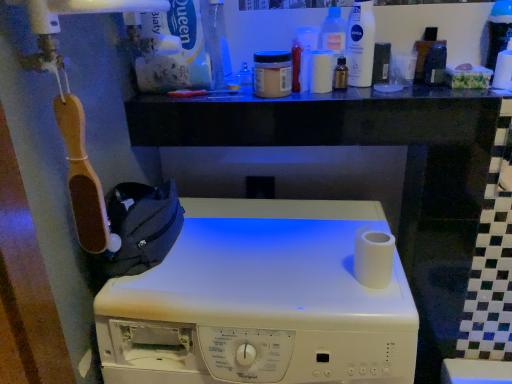
What do you see at coordinates (216, 40) in the screenshot? The image size is (512, 384). I see `transparent glass bottle at upper center` at bounding box center [216, 40].

Describe the element at coordinates (373, 257) in the screenshot. I see `white matte toilet paper at right, the second toilet paper positioned from the back` at that location.

Identify the location of matte plastic container at center, which is counted as the sixth toiletry, starting from the right. (245, 75).

The width and height of the screenshot is (512, 384). What are the coordinates of `white matte bottle at upper center, the 3th toiletry in the right-to-left sequence` in the screenshot? It's located at (321, 71).

This screenshot has width=512, height=384. What do you see at coordinates (333, 32) in the screenshot? I see `translucent plastic bottle at upper center, which is counted as the 1th cleaning product, starting from the left` at bounding box center [333, 32].

Where is `translucent amber bottle at upper center, the second toiletry in the right-to-left sequence`? This screenshot has height=384, width=512. translucent amber bottle at upper center, the second toiletry in the right-to-left sequence is located at coordinates (340, 74).

At what (x,y) coordinates should I click in order to perform the action: click on transparent glass bottle at upper center. Please return your answer as a coordinate pair (x, y). Image resolution: width=512 pixels, height=384 pixels. Looking at the image, I should click on (216, 40).

From the image's perspective, is white matte bottle at upper center, the 3th toiletry in the right-to-left sequence, below white matte toilet paper at right, the second toilet paper positioned from the back?

No, from the image's perspective, white matte bottle at upper center, the 3th toiletry in the right-to-left sequence, is not below white matte toilet paper at right, the second toilet paper positioned from the back.

Could you measure the distance between white matte bottle at upper center, the 4th toiletry viewed from the left, and white matte toilet paper at right, arranged as the first toilet paper when viewed from the left?

white matte bottle at upper center, the 4th toiletry viewed from the left, and white matte toilet paper at right, arranged as the first toilet paper when viewed from the left, are 16.28 inches apart from each other.

Could you tell me if white matte bottle at upper center, the 3th toiletry in the right-to-left sequence, is turned towards white matte toilet paper at right, arranged as the 2th toilet paper when viewed from the right?

No, white matte bottle at upper center, the 3th toiletry in the right-to-left sequence, is not aimed at white matte toilet paper at right, arranged as the 2th toilet paper when viewed from the right.

From a real-world perspective, between matte plastic container at center, which is counted as the sixth toiletry, starting from the right, and matte brown jar at upper center, the 5th toiletry from the right, who is vertically higher?

matte brown jar at upper center, the 5th toiletry from the right, from a real-world perspective.

From the image's perspective, would you say matte plastic container at center, which is counted as the sixth toiletry, starting from the right, is positioned over matte brown jar at upper center, which ranks as the second toiletry in left-to-right order?

Correct, matte plastic container at center, which is counted as the sixth toiletry, starting from the right, appears higher than matte brown jar at upper center, which ranks as the second toiletry in left-to-right order, in the image.

Can you confirm if matte plastic container at center, the first toiletry from the left, is smaller than matte brown jar at upper center, the 5th toiletry from the right?

Correct, matte plastic container at center, the first toiletry from the left, occupies less space than matte brown jar at upper center, the 5th toiletry from the right.

In terms of width, does matte plastic container at center, the first toiletry from the left, look wider or thinner when compared to matte brown jar at upper center, which ranks as the second toiletry in left-to-right order?

Clearly, matte plastic container at center, the first toiletry from the left, has less width compared to matte brown jar at upper center, which ranks as the second toiletry in left-to-right order.

Who is taller, matte black container at upper right, the first toiletry when ordered from right to left, or white matte toilet paper at right, the second toilet paper positioned from the back?

matte black container at upper right, the first toiletry when ordered from right to left, is taller.

Which is behind, point (425, 68) or point (388, 245)?

The point (425, 68) is behind.

Which toiletry is the 3rd one when counting from the back of the white matte toilet paper at right, arranged as the first toilet paper when viewed from the left? Please provide its 2D coordinates.

[(435, 64)]

Considering the sizes of transparent glass bottle at upper center and white matte toilet paper at right, positioned as the second toilet paper in top-to-bottom order, in the image, is transparent glass bottle at upper center wider or thinner than white matte toilet paper at right, positioned as the second toilet paper in top-to-bottom order,?

In the image, transparent glass bottle at upper center appears to be wider than white matte toilet paper at right, positioned as the second toilet paper in top-to-bottom order.

Based on the photo, looking at the image, does transparent glass bottle at upper center seem bigger or smaller compared to white matte toilet paper at right, acting as the 1th toilet paper starting from the bottom?

In the image, transparent glass bottle at upper center appears to be larger than white matte toilet paper at right, acting as the 1th toilet paper starting from the bottom.

From the image's perspective, is transparent glass bottle at upper center on top of white matte toilet paper at right, arranged as the first toilet paper when viewed from the left?

Correct, transparent glass bottle at upper center appears higher than white matte toilet paper at right, arranged as the first toilet paper when viewed from the left, in the image.

At what (x,y) coordinates should I click in order to perform the action: click on bottle that appears above the white matte toilet paper at right, the second toilet paper positioned from the back (from the image's perspective). Please return your answer as a coordinate pair (x, y). The height and width of the screenshot is (384, 512). Looking at the image, I should click on (216, 40).

Which object is further away from the camera taking this photo, matte black container at upper right, which is counted as the sixth toiletry, starting from the left, or matte brown jar at upper center, which ranks as the second toiletry in left-to-right order?

Positioned behind is matte black container at upper right, which is counted as the sixth toiletry, starting from the left.

Is point (426, 77) behind point (255, 74)?

No, it is in front of (255, 74).

From a real-world perspective, is matte black container at upper right, which is counted as the sixth toiletry, starting from the left, positioned above or below matte brown jar at upper center, which ranks as the second toiletry in left-to-right order?

From a real-world perspective, matte black container at upper right, which is counted as the sixth toiletry, starting from the left, is physically above matte brown jar at upper center, which ranks as the second toiletry in left-to-right order.

From a real-world perspective, which is physically below, translucent plastic bottle at upper center, which is counted as the 1th cleaning product, starting from the left, or white plastic container at center, the 4th toiletry viewed from the right?

From a 3D spatial view, white plastic container at center, the 4th toiletry viewed from the right, is below.

Which of these two, translucent plastic bottle at upper center, which is the 2th cleaning product from right to left, or white plastic container at center, the 4th toiletry viewed from the right, is wider?

translucent plastic bottle at upper center, which is the 2th cleaning product from right to left.

Is translucent plastic bottle at upper center, which is the 2th cleaning product from right to left, outside of white plastic container at center, the 4th toiletry viewed from the right?

Yes.

Could you measure the distance between matte black container at upper right, the first toiletry when ordered from right to left, and white plastic bottle at upper center, which ranks as the 1th cleaning product in right-to-left order?

They are 16.51 centimeters apart.

Is matte black container at upper right, the first toiletry when ordered from right to left, not within white plastic bottle at upper center, which ranks as the 1th cleaning product in right-to-left order?

matte black container at upper right, the first toiletry when ordered from right to left, lies outside white plastic bottle at upper center, which ranks as the 1th cleaning product in right-to-left order,'s area.

Does matte black container at upper right, which is counted as the sixth toiletry, starting from the left, turn towards white plastic bottle at upper center, which ranks as the 1th cleaning product in right-to-left order?

No, matte black container at upper right, which is counted as the sixth toiletry, starting from the left, is not oriented towards white plastic bottle at upper center, which ranks as the 1th cleaning product in right-to-left order.

From a real-world perspective, is matte black container at upper right, the first toiletry when ordered from right to left, physically located above or below white plastic bottle at upper center, which ranks as the 1th cleaning product in right-to-left order?

Clearly, from a real-world perspective, matte black container at upper right, the first toiletry when ordered from right to left, is below white plastic bottle at upper center, which ranks as the 1th cleaning product in right-to-left order.

Starting from the white matte toilet paper at right, the second toilet paper positioned from the back, which toiletry is the 2nd one to the left? Please provide its 2D coordinates.

[(321, 71)]

Where is `toiletry that is the 1st object to the right of the matte plastic container at center, the first toiletry from the left, starting at the anchor`? Image resolution: width=512 pixels, height=384 pixels. toiletry that is the 1st object to the right of the matte plastic container at center, the first toiletry from the left, starting at the anchor is located at coordinates (272, 74).

Considering their positions, is translucent amber bottle at upper center, the second toiletry in the right-to-left sequence, positioned further to matte black container at upper right, the first toiletry when ordered from right to left, than white plastic bottle at upper center, which ranks as the 1th cleaning product in right-to-left order?

translucent amber bottle at upper center, the second toiletry in the right-to-left sequence, is further to matte black container at upper right, the first toiletry when ordered from right to left.

Considering their positions, is translucent amber bottle at upper center, the 5th toiletry from the left, positioned further to translucent plastic bottle at upper center, which is the 2th cleaning product from right to left, than matte brown jar at upper center, which ranks as the second toiletry in left-to-right order?

matte brown jar at upper center, which ranks as the second toiletry in left-to-right order, is further to translucent plastic bottle at upper center, which is the 2th cleaning product from right to left.

Based on their spatial positions, is white plastic container at center, the 4th toiletry viewed from the right, or white matte bottle at upper center, the 3th toiletry in the right-to-left sequence, further from matte brown jar at upper center, which ranks as the second toiletry in left-to-right order?

Based on the image, white matte bottle at upper center, the 3th toiletry in the right-to-left sequence, appears to be further to matte brown jar at upper center, which ranks as the second toiletry in left-to-right order.

Looking at the image, which one is located closer to white plastic washing machine at center, white plastic container at center, the 3th toiletry in the left-to-right sequence, or matte black container at upper right, which is counted as the sixth toiletry, starting from the left?

white plastic container at center, the 3th toiletry in the left-to-right sequence, lies closer to white plastic washing machine at center than the other object.

Estimate the real-world distances between objects in this image. Which object is further from transparent glass bottle at upper center, white plastic bottle at upper center, the 2th cleaning product positioned from the left, or white plastic washing machine at center?

The object further to transparent glass bottle at upper center is white plastic washing machine at center.

Looking at the image, which one is located closer to white plastic washing machine at center, white plastic container at center, the 3th toiletry in the left-to-right sequence, or translucent plastic bottle at upper center, which is counted as the 1th cleaning product, starting from the left?

white plastic container at center, the 3th toiletry in the left-to-right sequence.

Estimate the real-world distances between objects in this image. Which object is closer to white matte toilet paper at upper right, the 1th toilet paper viewed from the right, white plastic container at center, the 3th toiletry in the left-to-right sequence, or white plastic bottle at upper center, which ranks as the 1th cleaning product in right-to-left order?

Among the two, white plastic bottle at upper center, which ranks as the 1th cleaning product in right-to-left order, is located nearer to white matte toilet paper at upper right, the 1th toilet paper viewed from the right.

Which object lies nearer to the anchor point white matte toilet paper at right, arranged as the first toilet paper when viewed from the left, matte plastic container at center, which is counted as the sixth toiletry, starting from the right, or matte black container at upper right, which is counted as the sixth toiletry, starting from the left?

The object closer to white matte toilet paper at right, arranged as the first toilet paper when viewed from the left, is matte black container at upper right, which is counted as the sixth toiletry, starting from the left.

Locate an element on the screen. This screenshot has height=384, width=512. toilet paper between matte brown jar at upper center, the 5th toiletry from the right, and white plastic washing machine at center in the up-down direction is located at coordinates (373, 257).

Find the location of `toilet paper located between matte plastic container at center, the first toiletry from the left, and white matte toilet paper at upper right, the 1th toilet paper viewed from the right, in the left-right direction`. toilet paper located between matte plastic container at center, the first toiletry from the left, and white matte toilet paper at upper right, the 1th toilet paper viewed from the right, in the left-right direction is located at coordinates (373, 257).

Where is `cleaning product that lies between white plastic bottle at upper center, which ranks as the 1th cleaning product in right-to-left order, and translucent amber bottle at upper center, the 5th toiletry from the left, from top to bottom`? cleaning product that lies between white plastic bottle at upper center, which ranks as the 1th cleaning product in right-to-left order, and translucent amber bottle at upper center, the 5th toiletry from the left, from top to bottom is located at coordinates (333, 32).

The width and height of the screenshot is (512, 384). Identify the location of cleaning product located between white plastic container at center, the 4th toiletry viewed from the right, and white plastic bottle at upper center, the 2th cleaning product positioned from the left, in the left-right direction. click(x=333, y=32).